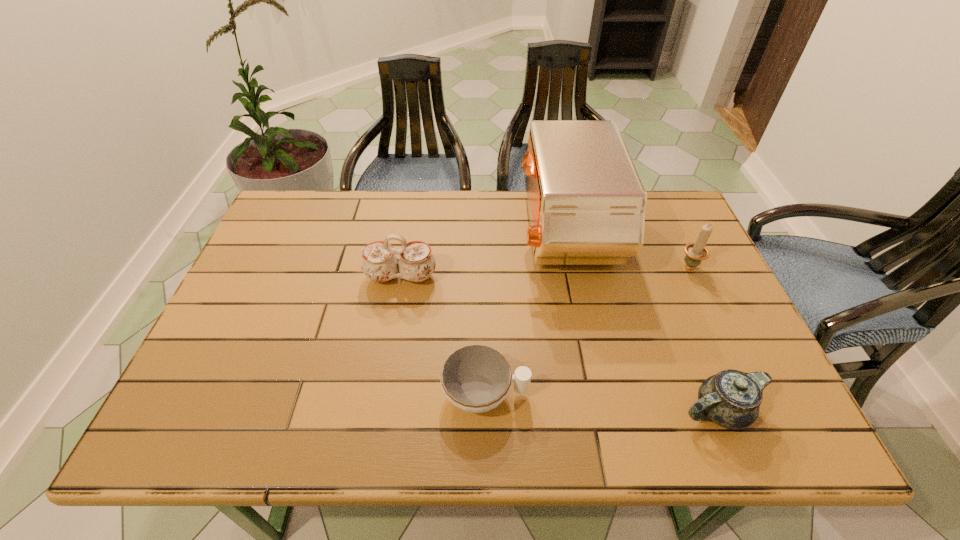
This screenshot has width=960, height=540. Find the location of `vacant space situated on the door side of the tallest object`. vacant space situated on the door side of the tallest object is located at coordinates coord(471,234).

The width and height of the screenshot is (960, 540). What are the coordinates of `free region located 0.210m on the door side of the tallest object` in the screenshot? It's located at (447, 234).

Locate an element on the screen. The height and width of the screenshot is (540, 960). free point located 0.230m on the handle side of the candle_holder is located at coordinates pyautogui.click(x=660, y=205).

The image size is (960, 540). I want to click on free space located 0.110m on the handle side of the candle_holder, so click(672, 230).

This screenshot has width=960, height=540. In order to click on free region located on the handle side of the candle_holder in this screenshot , I will do `click(676, 239)`.

The image size is (960, 540). I want to click on blank space located 0.210m by the handle of the tallest chinaware, so click(387, 359).

Find the location of `free region located 0.050m from the spout of the rightmost chinaware`. free region located 0.050m from the spout of the rightmost chinaware is located at coordinates tap(654, 410).

Where is `vacant space located from the spout of the rightmost chinaware`? The image size is (960, 540). vacant space located from the spout of the rightmost chinaware is located at coordinates pos(615,410).

Identify the location of vacant space positioned 0.270m from the spout of the rightmost chinaware. The height and width of the screenshot is (540, 960). (547, 410).

This screenshot has height=540, width=960. What are the coordinates of `vacant region located on the side with the handle of the second object from left to right` in the screenshot? It's located at (589, 394).